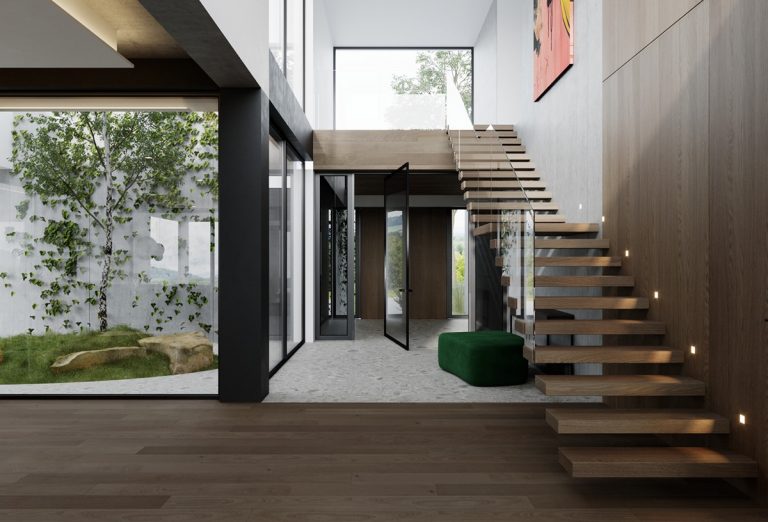
Where is `flooring`? The image size is (768, 522). flooring is located at coordinates (372, 364), (332, 485).